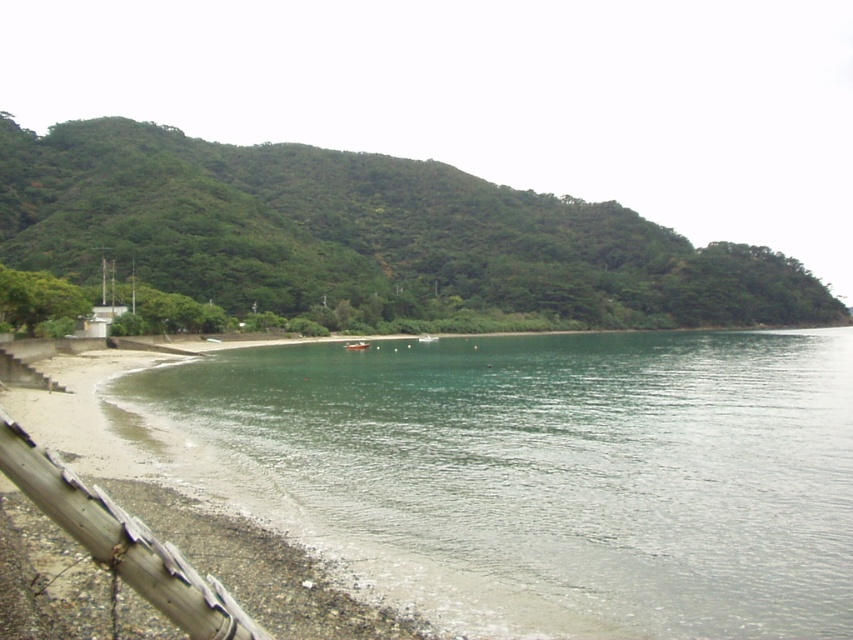
Question: Which is nearer to the clear water at lower left?

Choices:
 (A) green leafy hillside at upper left
 (B) rusty metal rail at lower left

Answer: (B)

Question: Which object is closer to the camera taking this photo?

Choices:
 (A) green leafy hillside at upper left
 (B) rusty metal rail at lower left

Answer: (B)

Question: Which object is positioned closest to the green leafy hillside at upper left?

Choices:
 (A) rusty metal rail at lower left
 (B) clear water at lower left

Answer: (B)

Question: Does clear water at lower left come behind rusty metal rail at lower left?

Choices:
 (A) yes
 (B) no

Answer: (A)

Question: Is clear water at lower left above rusty metal rail at lower left?

Choices:
 (A) yes
 (B) no

Answer: (B)

Question: Does clear water at lower left appear on the left side of green leafy hillside at upper left?

Choices:
 (A) yes
 (B) no

Answer: (A)